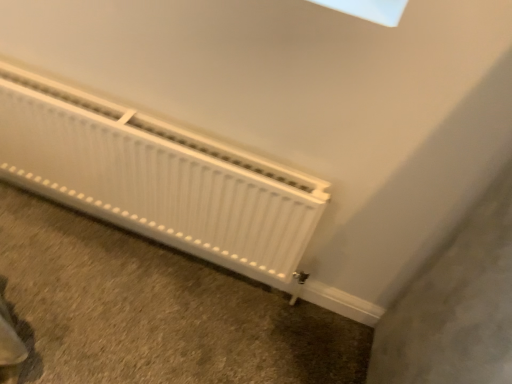
Question: Considering the positions of point (167, 284) and point (202, 170), is point (167, 284) closer or farther from the camera than point (202, 170)?

Choices:
 (A) closer
 (B) farther

Answer: (B)

Question: From a real-world perspective, is white matte radiator at lower left physically located above or below white matte radiator at lower left?

Choices:
 (A) above
 (B) below

Answer: (B)

Question: Is white matte radiator at lower left to the left or to the right of white matte radiator at lower left in the image?

Choices:
 (A) left
 (B) right

Answer: (A)

Question: Considering the positions of white matte radiator at lower left and white matte radiator at lower left in the image, is white matte radiator at lower left wider or thinner than white matte radiator at lower left?

Choices:
 (A) thin
 (B) wide

Answer: (A)

Question: Is point (73, 120) positioned closer to the camera than point (196, 349)?

Choices:
 (A) closer
 (B) farther

Answer: (A)

Question: From the image's perspective, relative to white matte radiator at lower left, is white matte radiator at lower left above or below?

Choices:
 (A) above
 (B) below

Answer: (A)

Question: Is white matte radiator at lower left taller or shorter than white matte radiator at lower left?

Choices:
 (A) tall
 (B) short

Answer: (A)